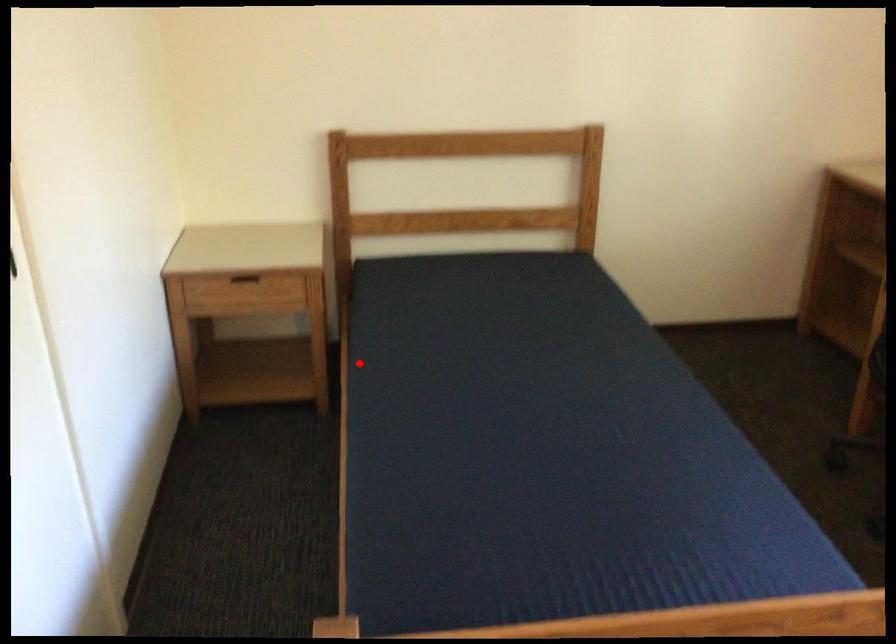
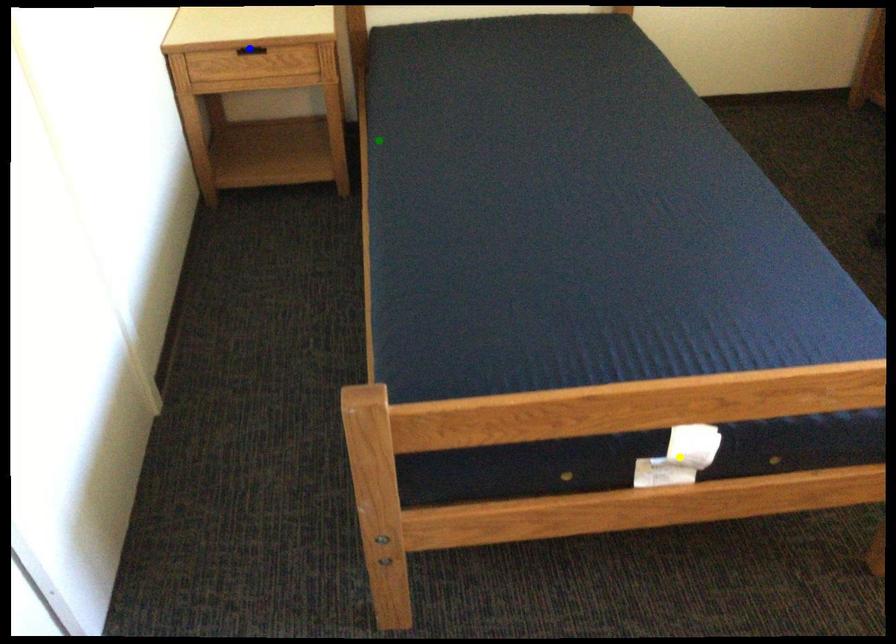
Question: I am providing you with two images of the same scene from different viewpoints. A red point is marked on the first image. You are given multiple points on the second image. Which spot in image 2 lines up with the point in image 1?

Choices:
 (A) green point
 (B) yellow point
 (C) blue point

Answer: (A)